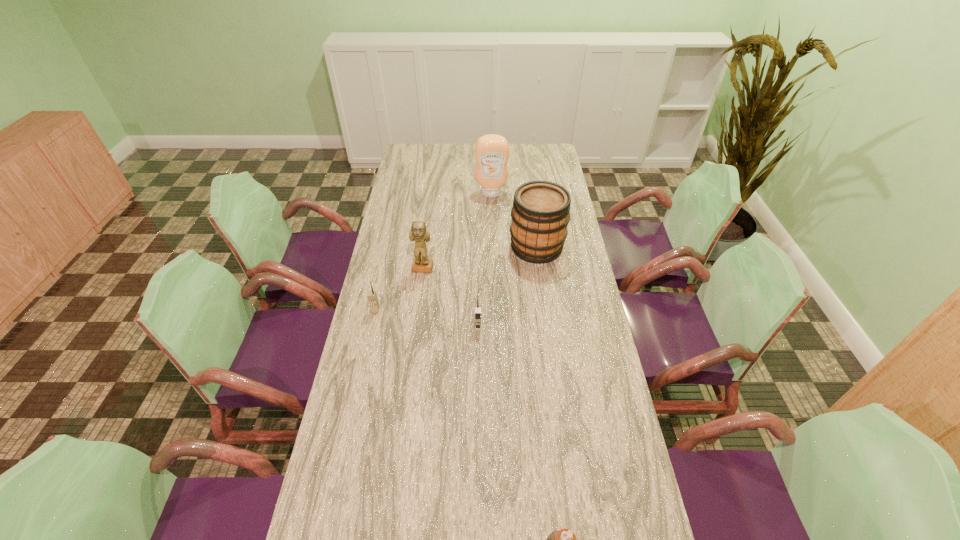
Where is `empty space between the condiment and the right cellular telephone`? empty space between the condiment and the right cellular telephone is located at coordinates 485,260.

Locate an element on the screen. This screenshot has width=960, height=540. vacant point located between the second nearest object and the farthest object is located at coordinates (485, 260).

This screenshot has width=960, height=540. In order to click on free spot between the cider and the leftmost object in this screenshot , I will do `click(456, 279)`.

Identify the location of blank region between the right cellular telephone and the farthest object. The height and width of the screenshot is (540, 960). coord(485,260).

Image resolution: width=960 pixels, height=540 pixels. In order to click on blank region between the cider and the fifth object from right to left in this screenshot , I will do `click(480, 258)`.

Locate which object ranks in proximity to the third nearest object. Please provide its 2D coordinates. Your answer should be formatted as a tuple, i.e. [(x, y)], where the tuple contains the x and y coordinates of a point satisfying the conditions above.

[(419, 233)]

Identify the location of the fifth closest object to the farther cellular telephone. This screenshot has width=960, height=540. (564, 539).

Where is `vacant space that satisfies the following two spatial constraints: 1. on the label of the condiment; 2. on the left side of the cider`? Image resolution: width=960 pixels, height=540 pixels. vacant space that satisfies the following two spatial constraints: 1. on the label of the condiment; 2. on the left side of the cider is located at coordinates (492, 247).